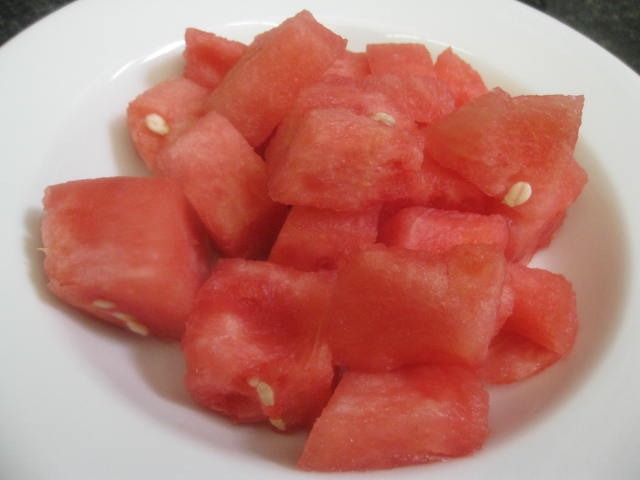
Locate an element on the screen. This screenshot has width=640, height=480. white ceramic bowl is located at coordinates (472, 25).